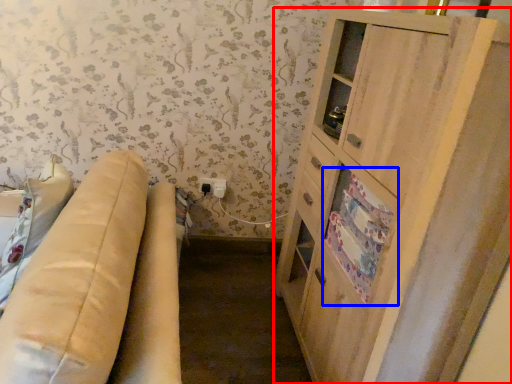
Question: Which point is further to the camera, cabinetry (highlighted by a red box) or drawer (highlighted by a blue box)?

Choices:
 (A) cabinetry
 (B) drawer

Answer: (B)